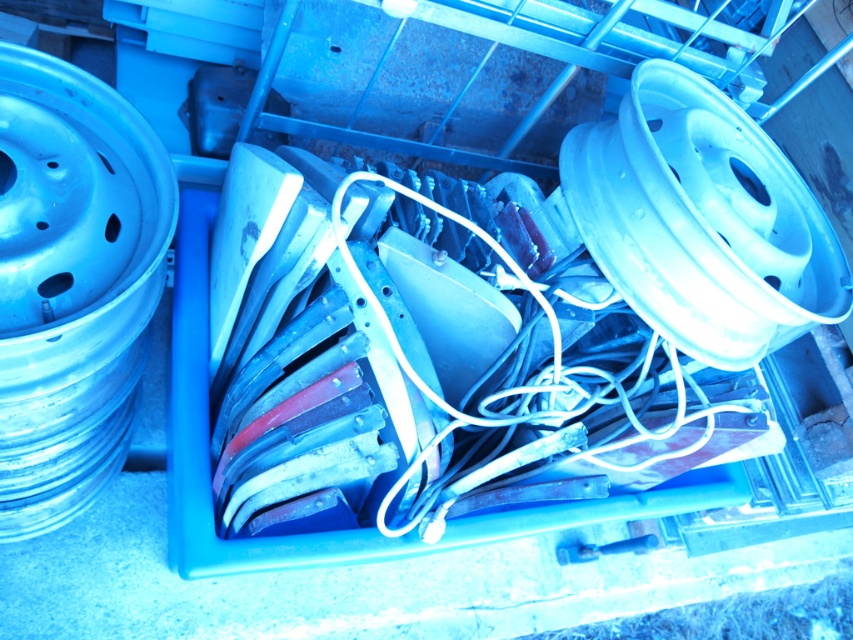
You are an auto mechanic trying to organize the hubcaps in the blue plastic crate. You have two hubcaps to place next to each other. The metallic silver rim at upper right and the blue metallic rim at left. Which one should you place first if you want to arrange them from largest to smallest?

You should place the metallic silver rim at upper right first because it is larger in size than the blue metallic rim at left.

You are organizing automotive parts in a blue plastic crate. You have a metallic silver rim at upper right and a blue metallic rim at left. Which rim is placed higher in the crate?

The metallic silver rim at upper right is positioned over the blue metallic rim at left, so it is placed higher in the crate.

Based on the photo, you are an auto mechanic trying to access the metallic silver rim at upper right and the blue metallic rim at left. Which one is closer to you?

The metallic silver rim at upper right is closer to you than the blue metallic rim at left.